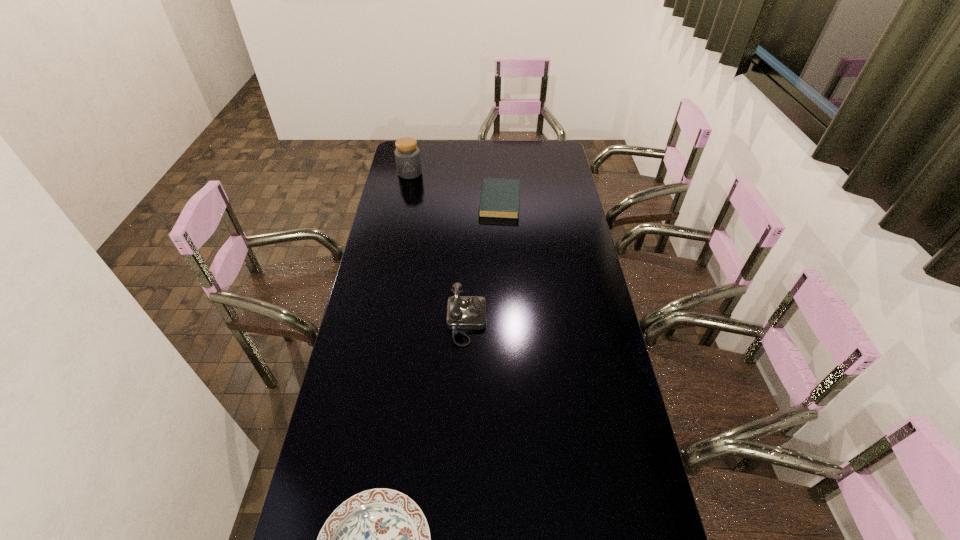
The height and width of the screenshot is (540, 960). Identify the location of the tallest object. (407, 155).

Identify the location of the farthest object. (407, 155).

Locate an element on the screen. This screenshot has height=540, width=960. telephone is located at coordinates (463, 312).

The image size is (960, 540). In order to click on the third farthest object in this screenshot , I will do `click(463, 312)`.

You are a GUI agent. You are given a task and a screenshot of the screen. Output one action in this format:
    pyautogui.click(x=<x>, y=<y>)
    Task: Click on the book
    Image resolution: width=960 pixels, height=540 pixels.
    Given the screenshot: What is the action you would take?
    pyautogui.click(x=500, y=198)

The image size is (960, 540). In order to click on vacant space located 0.050m on the surface of the tallest object near the warning symbol in this screenshot , I will do `click(407, 186)`.

I want to click on free spot located 0.290m on the dial of the telephone, so click(569, 322).

At what (x,y) coordinates should I click in order to perform the action: click on vacant space situated 0.080m on the back of the book. Please return your answer as a coordinate pair (x, y). Looking at the image, I should click on (498, 176).

I want to click on object present at the left edge, so click(407, 155).

This screenshot has height=540, width=960. In the image, there is a desktop. Identify the location of vacant space at the far edge. (479, 158).